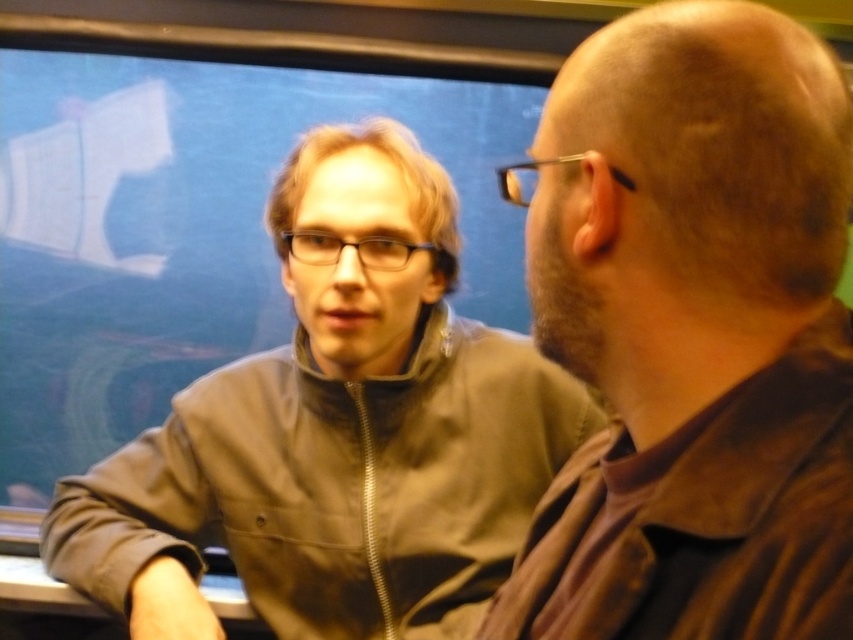
Where is `brown leather jacket at right`? The image size is (853, 640). brown leather jacket at right is located at coordinates (692, 332).

Where is `brown leather jacket at right`? Image resolution: width=853 pixels, height=640 pixels. brown leather jacket at right is located at coordinates (692, 332).